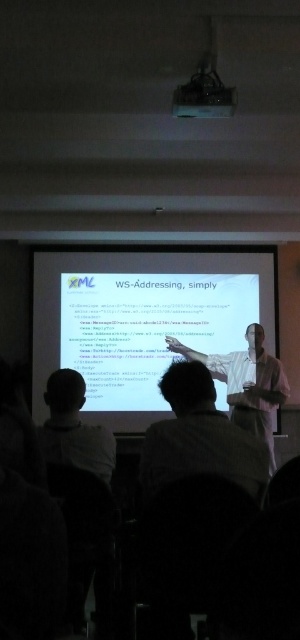
You are an attendee at the presentation and want to take a photo of the presenter. The presenter is standing to the right of the screen. You are currently facing the screen. To get a clear shot of the white shirt at center and light brown hair at lower left, should you move to your left or right?

The white shirt at center is positioned under light brown hair at lower left. Since the presenter is to the right of the screen, moving to your left would align you with the presenter, allowing you to capture both the white shirt at center and the light brown hair at lower left in your photo.

You are sitting in the audience facing the presenter and the screen. There are two points marked on the screen at coordinates point (261, 465) and point (72, 433). From your perspective, which point is closer to you?

Point (261, 465) is in front of point (72, 433), so it is closer to you.